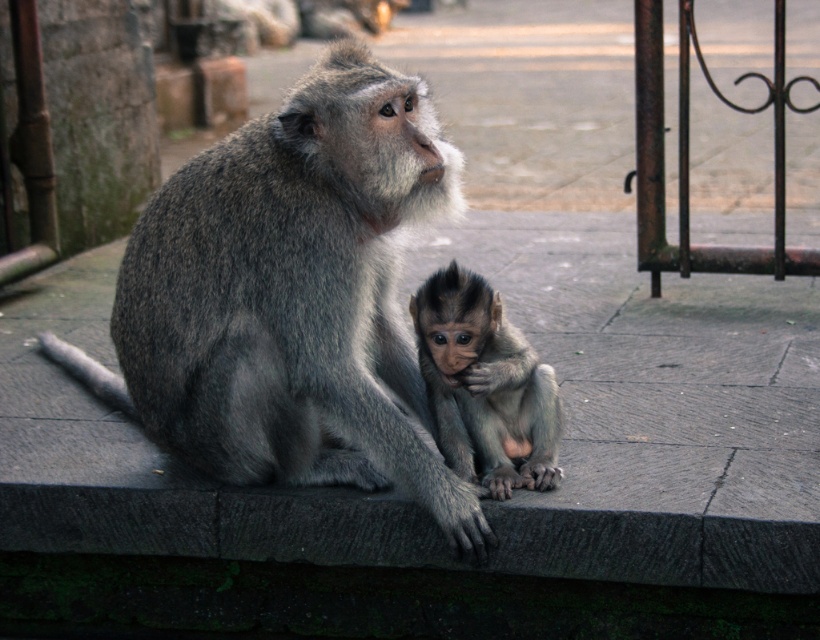
Question: Among these objects, which one is farthest from the camera?

Choices:
 (A) soft gray fur monkey at center
 (B) gray furry monkey at center

Answer: (A)

Question: Does gray furry monkey at center appear on the right side of soft gray fur monkey at center?

Choices:
 (A) yes
 (B) no

Answer: (B)

Question: Is gray furry monkey at center thinner than soft gray fur monkey at center?

Choices:
 (A) no
 (B) yes

Answer: (A)

Question: Is gray furry monkey at center closer to the viewer compared to soft gray fur monkey at center?

Choices:
 (A) no
 (B) yes

Answer: (B)